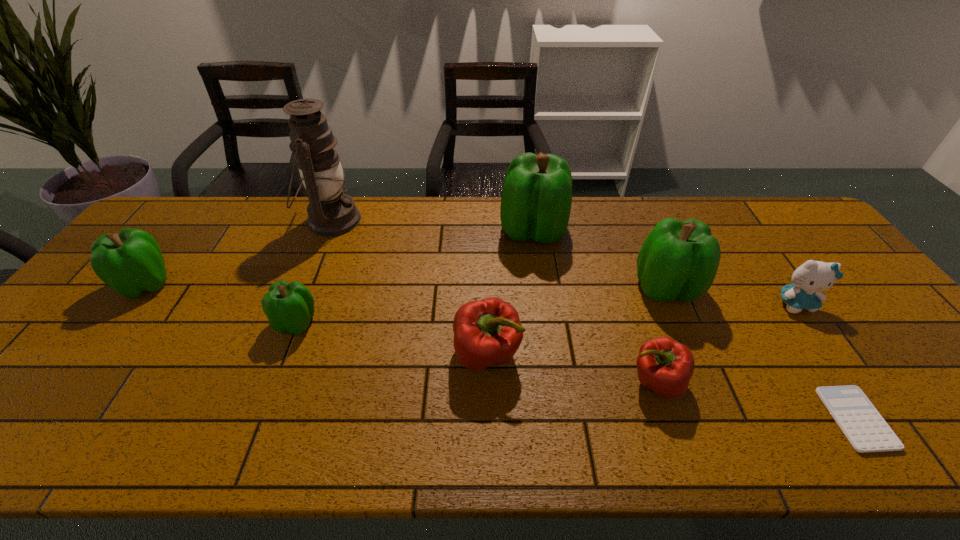
You are a GUI agent. You are given a task and a screenshot of the screen. Output one action in this format:
    pyautogui.click(x=<x>, y=<y>)
    Task: Click on the free space located on the face of the kitten
    This screenshot has height=540, width=960.
    Given the screenshot: What is the action you would take?
    pyautogui.click(x=895, y=445)

The height and width of the screenshot is (540, 960). Find the location of `vacant space located on the back of the fifth bell pepper from right to left`. vacant space located on the back of the fifth bell pepper from right to left is located at coordinates (323, 256).

You are a GUI agent. You are given a task and a screenshot of the screen. Output one action in this format:
    pyautogui.click(x=<x>, y=<y>)
    Task: Click on the vacant space situated on the left of the smaller pink bell pepper
    The width and height of the screenshot is (960, 540).
    Given the screenshot: What is the action you would take?
    pyautogui.click(x=579, y=382)

This screenshot has height=540, width=960. I want to click on free space located on the left of the white calculator, so click(761, 418).

This screenshot has height=540, width=960. I want to click on oil lamp present at the far edge, so click(x=330, y=212).

Locate an element on the screen. This screenshot has width=960, height=540. bell pepper that is at the far edge is located at coordinates (536, 199).

This screenshot has width=960, height=540. Identify the location of object that is at the near edge. (866, 430).

The image size is (960, 540). I want to click on object that is at the left edge, so (x=130, y=262).

Locate an element on the screen. vacant space at the far edge of the desktop is located at coordinates (725, 219).

In the image, there is a desktop. Where is `free space at the near edge`? The height and width of the screenshot is (540, 960). free space at the near edge is located at coordinates (762, 447).